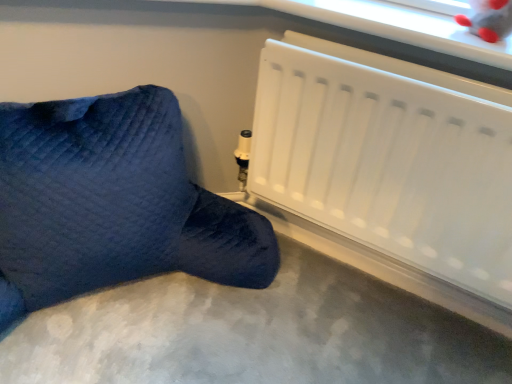
This screenshot has height=384, width=512. I want to click on white matte radiator at lower right, so click(x=389, y=158).

I want to click on smooth gray carpet at lower center, so click(254, 333).

What do you see at coordinates (112, 203) in the screenshot? I see `velvety blue bean bag at lower left` at bounding box center [112, 203].

At what (x,y) coordinates should I click in order to perform the action: click on white matte radiator at lower right. Please return your answer as a coordinate pair (x, y). The image size is (512, 384). Looking at the image, I should click on (389, 158).

Do you think velvety blue bean bag at lower left is within smooth gray carpet at lower center, or outside of it?

velvety blue bean bag at lower left exists outside the volume of smooth gray carpet at lower center.

Is velvety blue bean bag at lower left looking in the opposite direction of smooth gray carpet at lower center?

velvety blue bean bag at lower left is not turned away from smooth gray carpet at lower center.

Which of these two, velvety blue bean bag at lower left or smooth gray carpet at lower center, is smaller?

Smaller between the two is smooth gray carpet at lower center.

Relative to smooth gray carpet at lower center, is velvety blue bean bag at lower left in front or behind?

Visually, velvety blue bean bag at lower left is located behind smooth gray carpet at lower center.

From a real-world perspective, is white matte radiator at lower right positioned over smooth gray carpet at lower center based on gravity?

Indeed, from a real-world perspective, white matte radiator at lower right stands above smooth gray carpet at lower center.

Between point (362, 167) and point (237, 362), which one is positioned behind?

Point (237, 362)

Can you confirm if white matte radiator at lower right is smaller than smooth gray carpet at lower center?

No.

Considering the relative sizes of white matte radiator at lower right and smooth gray carpet at lower center in the image provided, is white matte radiator at lower right taller than smooth gray carpet at lower center?

Correct, white matte radiator at lower right is much taller as smooth gray carpet at lower center.

Can you tell me how much velvety blue bean bag at lower left and white matte radiator at lower right differ in facing direction?

The angular difference between velvety blue bean bag at lower left and white matte radiator at lower right is 54 degrees.

Is velvety blue bean bag at lower left placed right next to white matte radiator at lower right?

velvety blue bean bag at lower left and white matte radiator at lower right are clearly separated.

From a real-world perspective, does velvety blue bean bag at lower left sit lower than white matte radiator at lower right?

Yes.

Would you say velvety blue bean bag at lower left is outside white matte radiator at lower right?

Indeed, velvety blue bean bag at lower left is completely outside white matte radiator at lower right.

From a real-world perspective, is smooth gray carpet at lower center below velvety blue bean bag at lower left?

Yes.

Is point (364, 275) less distant than point (59, 247)?

No, it is behind (59, 247).

Does smooth gray carpet at lower center turn towards velvety blue bean bag at lower left?

No, smooth gray carpet at lower center is not facing towards velvety blue bean bag at lower left.

In the image, is smooth gray carpet at lower center on the left side or the right side of velvety blue bean bag at lower left?

From the image, it's evident that smooth gray carpet at lower center is to the right of velvety blue bean bag at lower left.

Where is `radiator above the smooth gray carpet at lower center (from the image's perspective)`? This screenshot has height=384, width=512. radiator above the smooth gray carpet at lower center (from the image's perspective) is located at coordinates (389, 158).

Considering the relative positions of smooth gray carpet at lower center and white matte radiator at lower right in the image provided, is smooth gray carpet at lower center to the left of white matte radiator at lower right from the viewer's perspective?

Yes.

Is point (33, 328) more distant than point (384, 109)?

That is True.

Is smooth gray carpet at lower center positioned with its back to white matte radiator at lower right?

No.

From a real-world perspective, is white matte radiator at lower right physically located above or below velvety blue bean bag at lower left?

white matte radiator at lower right is situated higher than velvety blue bean bag at lower left in the real world.

Between white matte radiator at lower right and velvety blue bean bag at lower left, which one has smaller width?

Thinner between the two is white matte radiator at lower right.

How much distance is there between white matte radiator at lower right and velvety blue bean bag at lower left?

12.82 inches.

Does point (461, 248) come farther from viewer compared to point (98, 228)?

No, it is not.

Locate an element on the screen. furniture above the smooth gray carpet at lower center (from the image's perspective) is located at coordinates (112, 203).

The width and height of the screenshot is (512, 384). What are the coordinates of `radiator behind the smooth gray carpet at lower center` in the screenshot? It's located at (389, 158).

Considering their positions, is white matte radiator at lower right positioned further to smooth gray carpet at lower center than velvety blue bean bag at lower left?

white matte radiator at lower right.

From the image, which object appears to be farther from white matte radiator at lower right, velvety blue bean bag at lower left or smooth gray carpet at lower center?

smooth gray carpet at lower center.

From the image, which object appears to be nearer to smooth gray carpet at lower center, velvety blue bean bag at lower left or white matte radiator at lower right?

Based on the image, velvety blue bean bag at lower left appears to be nearer to smooth gray carpet at lower center.

Considering their positions, is smooth gray carpet at lower center positioned further to velvety blue bean bag at lower left than white matte radiator at lower right?

Based on the image, white matte radiator at lower right appears to be further to velvety blue bean bag at lower left.

Based on their spatial positions, is smooth gray carpet at lower center or velvety blue bean bag at lower left closer to white matte radiator at lower right?

The object closer to white matte radiator at lower right is velvety blue bean bag at lower left.

When comparing their distances from velvety blue bean bag at lower left, does white matte radiator at lower right or smooth gray carpet at lower center seem closer?

smooth gray carpet at lower center lies closer to velvety blue bean bag at lower left than the other object.

Where is `concrete between velvety blue bean bag at lower left and white matte radiator at lower right from left to right`? concrete between velvety blue bean bag at lower left and white matte radiator at lower right from left to right is located at coordinates (254, 333).